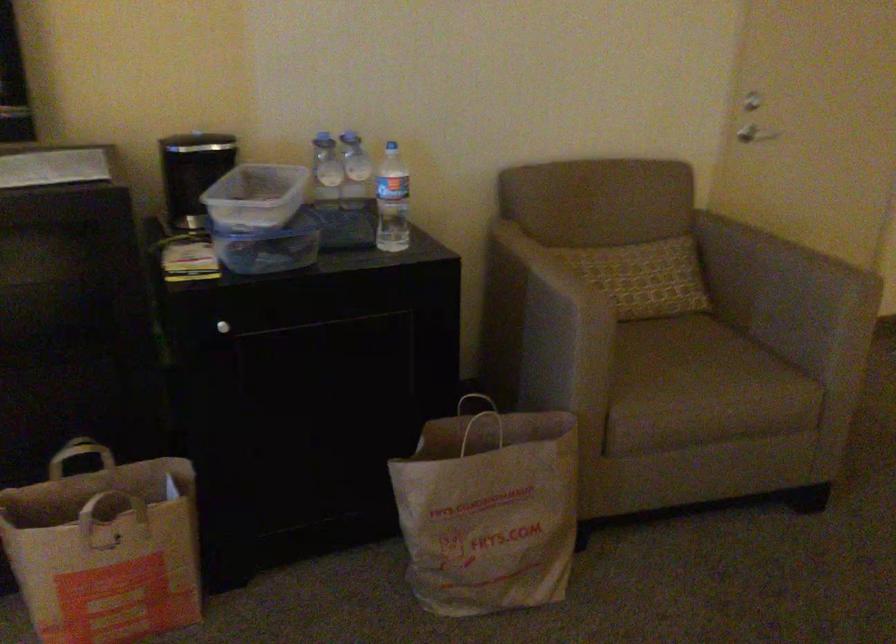
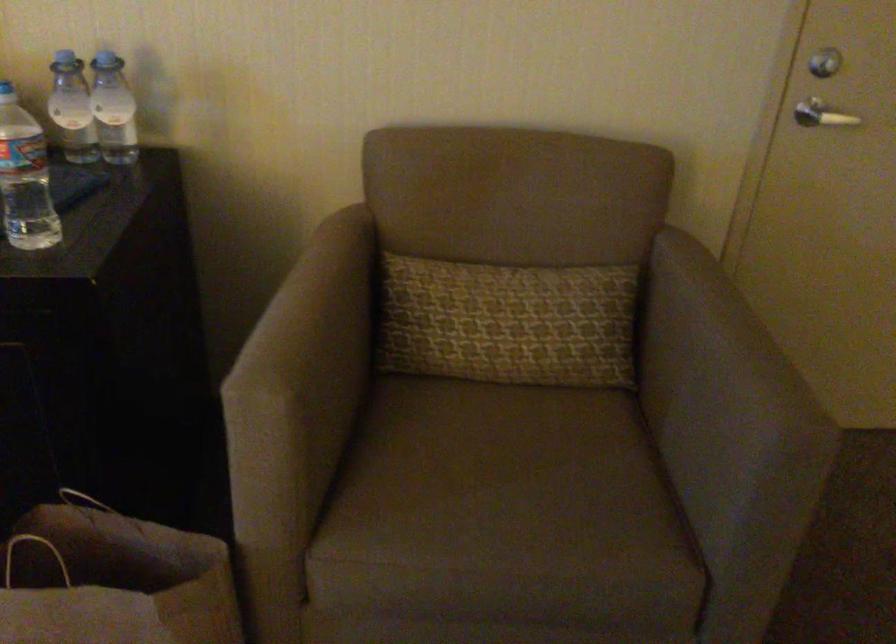
In a continuous first-person perspective shot, in which direction is the camera moving?

The cameraman moved toward right, forward.